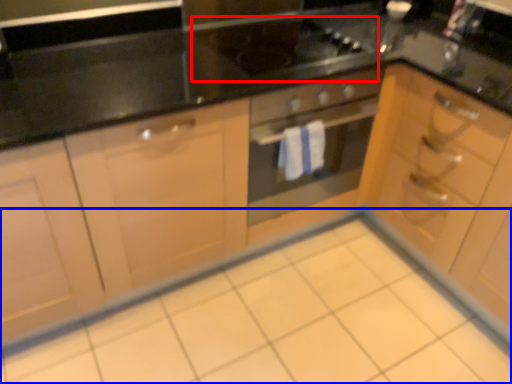
Question: Which object is closer to the camera taking this photo, gas stove (highlighted by a red box) or ceramic tile (highlighted by a blue box)?

Choices:
 (A) gas stove
 (B) ceramic tile

Answer: (B)